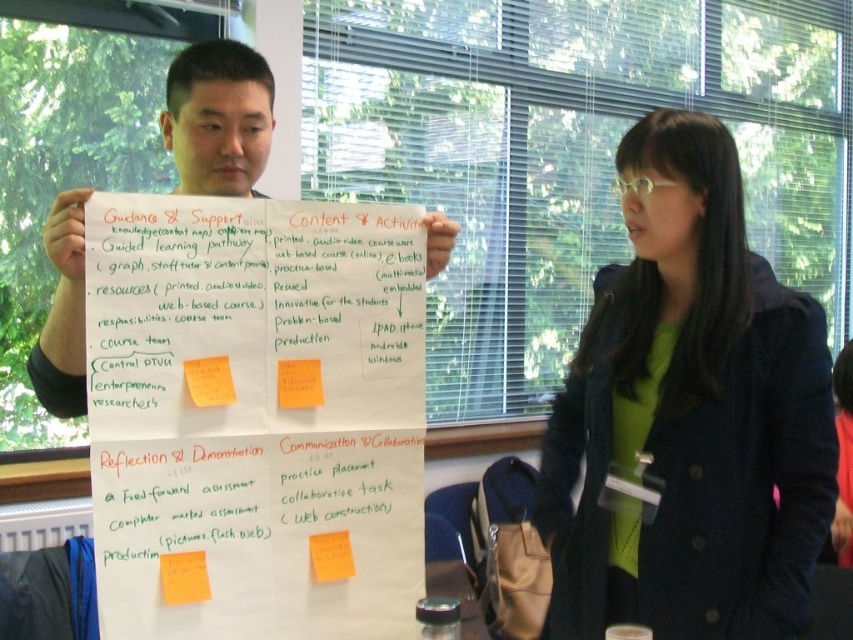
Question: Among these points, which one is farthest from the camera?

Choices:
 (A) (321, 403)
 (B) (631, 172)

Answer: (B)

Question: Observing the image, what is the correct spatial positioning of green matte jacket at center in reference to yellow sticky note at center?

Choices:
 (A) left
 (B) right

Answer: (B)

Question: Which object is closer to the camera taking this photo?

Choices:
 (A) yellow paper at center
 (B) yellow sticky note at center
 (C) orange paper at center

Answer: (C)

Question: Can you confirm if white paper at center is positioned above orange sticky note at center?

Choices:
 (A) no
 (B) yes

Answer: (B)

Question: Which point is farther to the camera?

Choices:
 (A) white paper at center
 (B) yellow paper at center

Answer: (B)

Question: Does green matte jacket at center appear under orange sticky note at center?

Choices:
 (A) no
 (B) yes

Answer: (A)